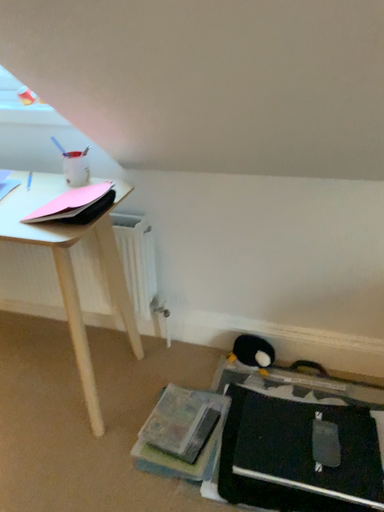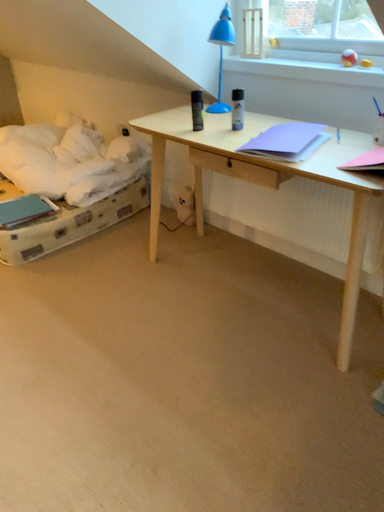
Question: Which way did the camera rotate in the video?

Choices:
 (A) rotated left
 (B) rotated right

Answer: (A)